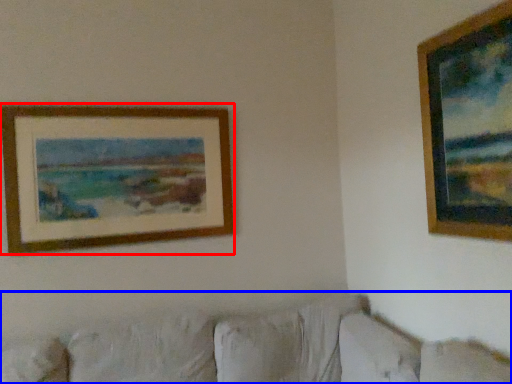
Question: Which of the following is the closest to the observer, picture frame (highlighted by a red box) or couch (highlighted by a blue box)?

Choices:
 (A) picture frame
 (B) couch

Answer: (B)